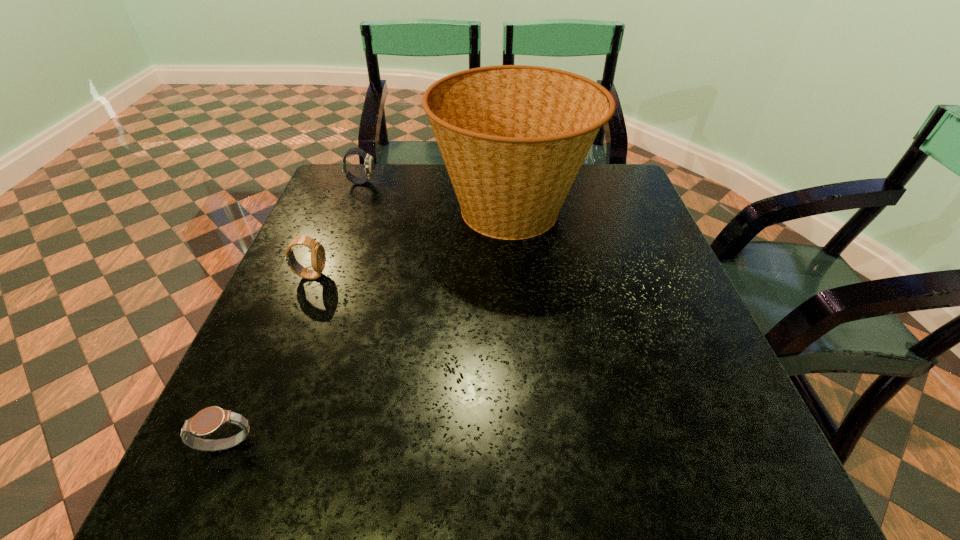
Identify the location of basket. The image size is (960, 540). (513, 138).

At what (x,y) coordinates should I click in order to perform the action: click on the tallest object. Please return your answer as a coordinate pair (x, y). The image size is (960, 540). Looking at the image, I should click on (513, 138).

I want to click on the farthest watch, so click(369, 165).

At what (x,y) coordinates should I click in order to perform the action: click on the second farthest watch. Please return your answer as a coordinate pair (x, y). The height and width of the screenshot is (540, 960). Looking at the image, I should click on 318,258.

I want to click on the shortest object, so click(x=207, y=421).

You are a GUI agent. You are given a task and a screenshot of the screen. Output one action in this format:
    pyautogui.click(x=<x>, y=<y>)
    Task: Click on the nearest object
    
    Given the screenshot: What is the action you would take?
    pyautogui.click(x=207, y=421)

Locate an element on the screen. This screenshot has width=960, height=540. free region located 0.160m on the left of the basket is located at coordinates (372, 210).

Find the location of a particular element. This screenshot has height=540, width=960. free region located 0.260m on the face of the farthest watch is located at coordinates (465, 182).

At what (x,y) coordinates should I click in order to perform the action: click on free location located 0.110m on the face of the second nearest watch. Please return your answer as a coordinate pair (x, y). The width and height of the screenshot is (960, 540). Looking at the image, I should click on (375, 275).

Locate an element on the screen. This screenshot has height=540, width=960. vacant space situated 0.400m on the right of the shortest object is located at coordinates (506, 447).